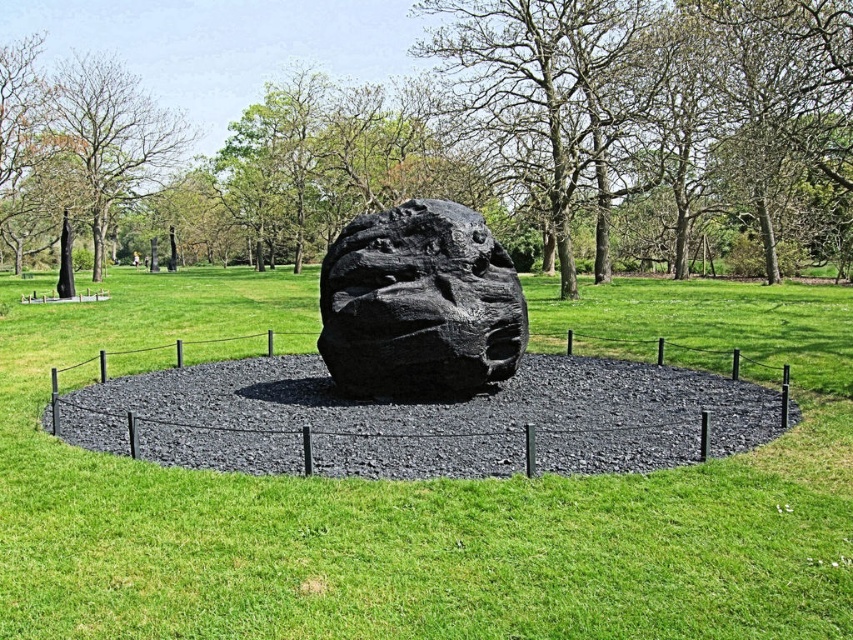
Can you confirm if green leafy tree at center is positioned to the right of black rough stone at center?

Incorrect, green leafy tree at center is not on the right side of black rough stone at center.

Is green leafy tree at center positioned at the back of black rough stone at center?

Yes, green leafy tree at center is further from the viewer.

Which is behind, point (207, 92) or point (350, 360)?

Positioned behind is point (207, 92).

The width and height of the screenshot is (853, 640). I want to click on green leafy tree at center, so click(447, 129).

This screenshot has height=640, width=853. Describe the element at coordinates (422, 419) in the screenshot. I see `black gravel at center` at that location.

Does black gravel at center lie behind black rough stone at center?

No, it is in front of black rough stone at center.

Is point (219, 433) closer to camera compared to point (392, 246)?

Yes, it is in front of point (392, 246).

Locate an element on the screen. The width and height of the screenshot is (853, 640). black gravel at center is located at coordinates (422, 419).

Who is shorter, green leafy tree at center or black gravel at center?

black gravel at center is shorter.

Can you confirm if green leafy tree at center is positioned below black gravel at center?

Incorrect, green leafy tree at center is not positioned below black gravel at center.

Locate an element on the screen. This screenshot has width=853, height=640. green leafy tree at center is located at coordinates (447, 129).